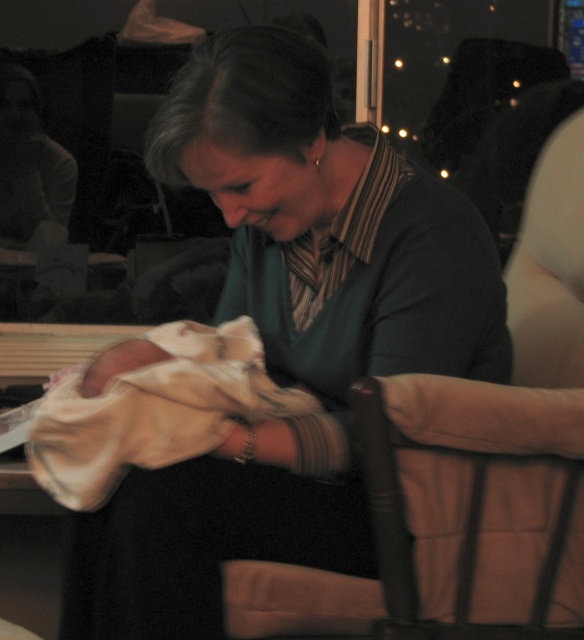
Does brown fabric armchair at center have a greater width compared to soft white blanket at center?

Yes, brown fabric armchair at center is wider than soft white blanket at center.

Who is more distant from viewer, [562,460] or [192,333]?

The point [192,333] is more distant.

Does point (558, 321) come behind point (193, 396)?

That is True.

The width and height of the screenshot is (584, 640). Identify the location of brown fabric armchair at center. (509, 432).